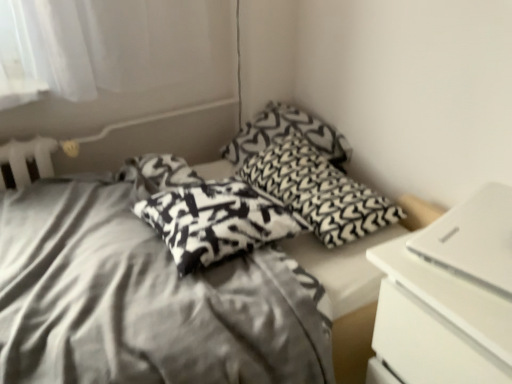
Question: From the image's perspective, is white matte laptop at right located above black and white patterned pillow at center, the 2th pillow when ordered from front to back?

Choices:
 (A) yes
 (B) no

Answer: (B)

Question: From the image's perspective, would you say white matte laptop at right is shown under black and white patterned pillow at center, the 2th pillow when ordered from front to back?

Choices:
 (A) yes
 (B) no

Answer: (A)

Question: Is the surface of white matte laptop at right in direct contact with black and white patterned pillow at center, which ranks as the second pillow in back-to-front order?

Choices:
 (A) yes
 (B) no

Answer: (B)

Question: Can we say white matte laptop at right lies outside black and white patterned pillow at center, the 2th pillow when ordered from front to back?

Choices:
 (A) yes
 (B) no

Answer: (A)

Question: Is white matte laptop at right turned away from black and white patterned pillow at center, the 2th pillow when ordered from front to back?

Choices:
 (A) no
 (B) yes

Answer: (A)

Question: Is white matte laptop at right shorter than black and white patterned pillow at center, the 2th pillow when ordered from front to back?

Choices:
 (A) no
 (B) yes

Answer: (B)

Question: Can you confirm if silky fabric bed at center is taller than black and white patterned pillow at center, the 2th pillow when ordered from front to back?

Choices:
 (A) yes
 (B) no

Answer: (A)

Question: Can you confirm if silky fabric bed at center is thinner than black and white patterned pillow at center, which ranks as the second pillow in back-to-front order?

Choices:
 (A) yes
 (B) no

Answer: (B)

Question: Considering the relative sizes of silky fabric bed at center and black and white patterned pillow at center, which ranks as the second pillow in back-to-front order, in the image provided, is silky fabric bed at center wider than black and white patterned pillow at center, which ranks as the second pillow in back-to-front order,?

Choices:
 (A) yes
 (B) no

Answer: (A)

Question: Considering the relative sizes of silky fabric bed at center and black and white patterned pillow at center, which ranks as the second pillow in back-to-front order, in the image provided, is silky fabric bed at center bigger than black and white patterned pillow at center, which ranks as the second pillow in back-to-front order,?

Choices:
 (A) no
 (B) yes

Answer: (B)

Question: From the image's perspective, would you say silky fabric bed at center is positioned over black and white patterned pillow at center, the 2th pillow when ordered from front to back?

Choices:
 (A) no
 (B) yes

Answer: (A)

Question: Is silky fabric bed at center not near black and white patterned pillow at center, which ranks as the second pillow in back-to-front order?

Choices:
 (A) yes
 (B) no

Answer: (B)

Question: Is black and white patterned pillow at center, which ranks as the second pillow in back-to-front order, shorter than silky fabric bed at center?

Choices:
 (A) yes
 (B) no

Answer: (A)